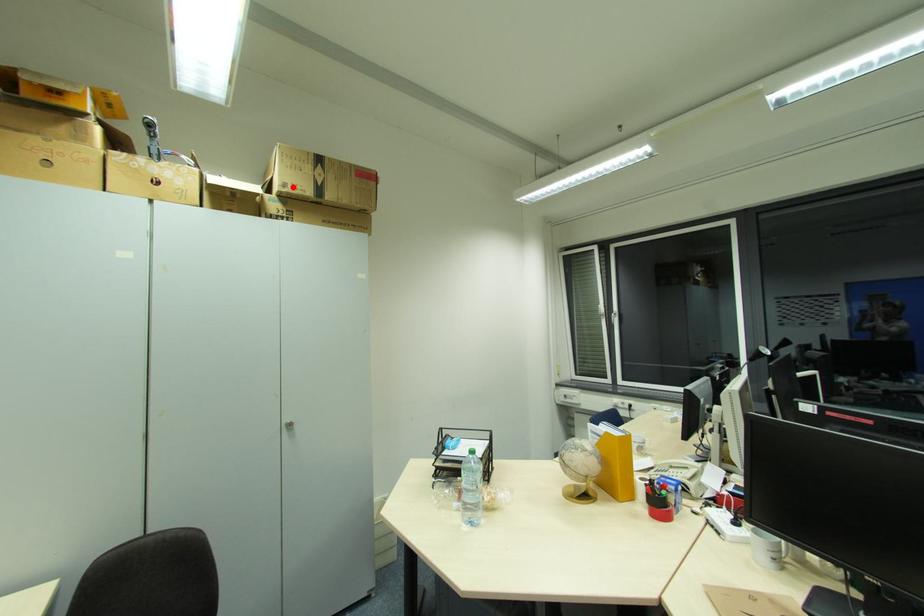
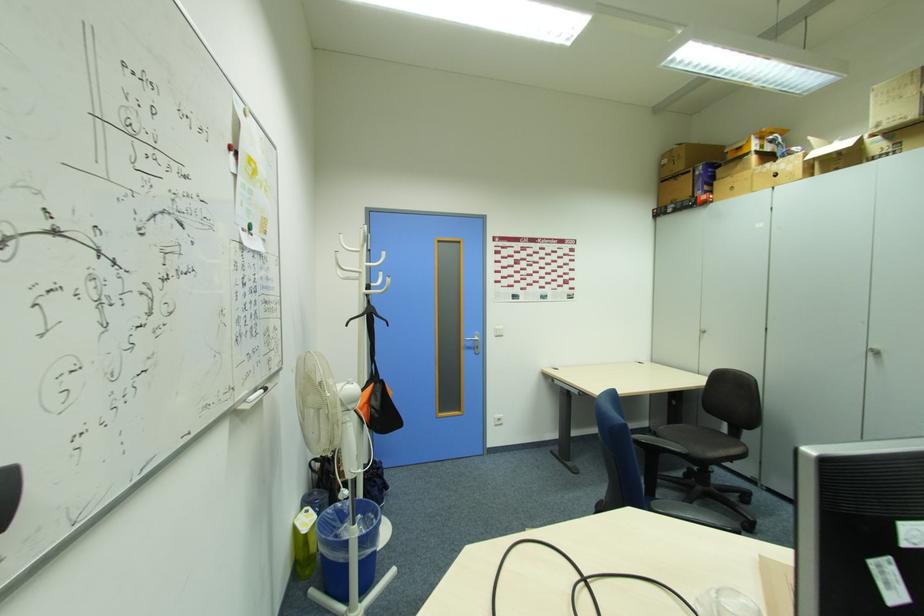
Question: I am providing you with two images of the same scene from different viewpoints. Image1 has a red point marked. In image2, the corresponding 3D location appears at what relative position? Reply with the corresponding letter.

Choices:
 (A) Closer
 (B) Farther

Answer: (B)